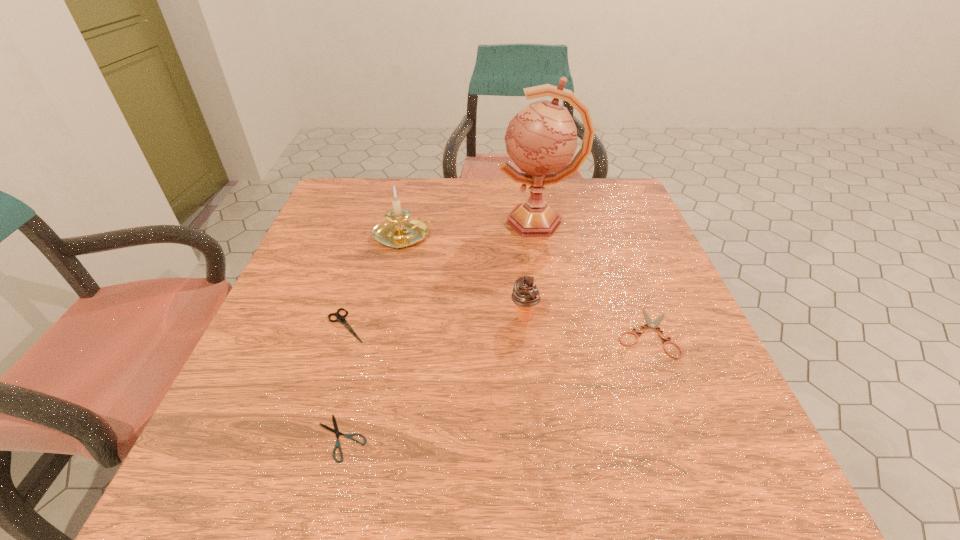
Locate an element on the screen. Image resolution: width=960 pixels, height=540 pixels. free space at the far edge of the desktop is located at coordinates tap(488, 188).

The height and width of the screenshot is (540, 960). I want to click on vacant point at the left edge, so click(x=320, y=403).

Locate an element on the screen. Image resolution: width=960 pixels, height=540 pixels. vacant point at the right edge is located at coordinates tap(658, 374).

In the image, there is a desktop. Identify the location of vacant space at the far left corner. (351, 188).

You are a GUI agent. You are given a task and a screenshot of the screen. Output one action in this format:
    pyautogui.click(x=<x>, y=<y>)
    Task: Click on the free spot at the far right corner of the desktop
    
    Given the screenshot: What is the action you would take?
    pyautogui.click(x=600, y=197)

Locate an element on the screen. vacant space at the near right corner is located at coordinates (732, 490).

Where is `vacant space that is in between the tallest object and the fifth shortest object`? vacant space that is in between the tallest object and the fifth shortest object is located at coordinates (471, 229).

The image size is (960, 540). I want to click on empty space between the globe and the candle holder, so [471, 229].

Identify the location of vacant space in between the tallest object and the icecream. The height and width of the screenshot is (540, 960). (531, 270).

The image size is (960, 540). I want to click on empty space between the tallest shears and the nearest object, so click(344, 382).